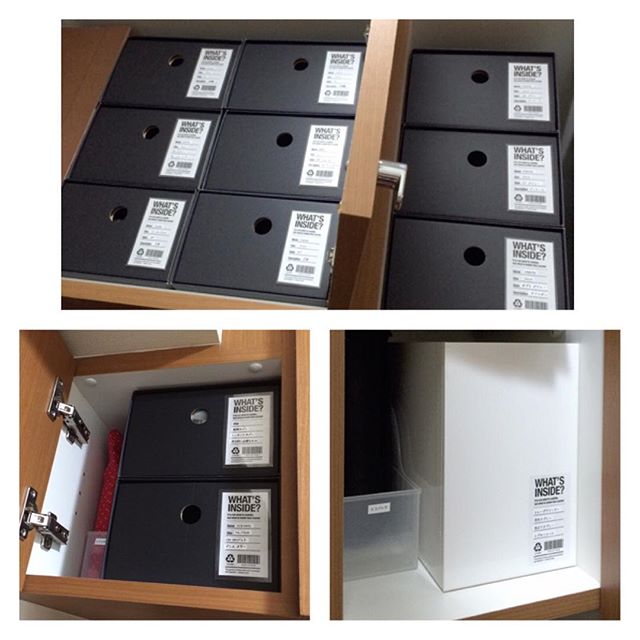
Find the location of a particular element. shelf is located at coordinates (390, 580).